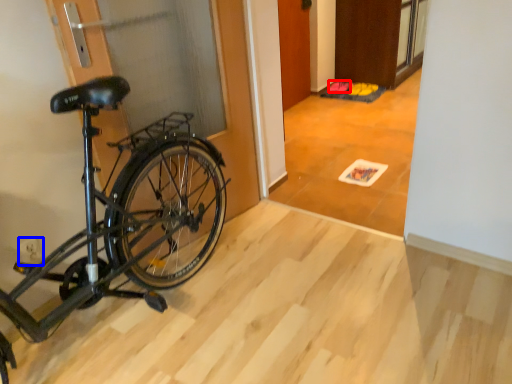
Question: Among these objects, which one is nearest to the camera, walking shoe (highlighted by a red box) or power plugs and sockets (highlighted by a blue box)?

Choices:
 (A) walking shoe
 (B) power plugs and sockets

Answer: (B)